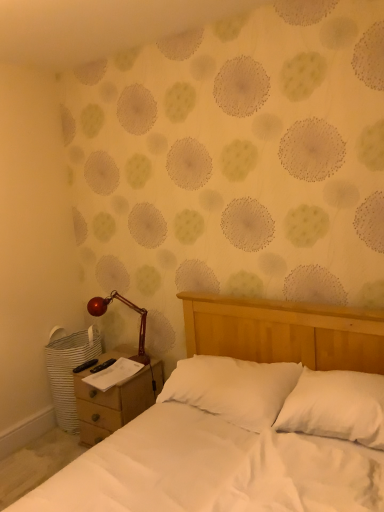
Question: Is white soft pillow at center, which appears as the 2th pillow when viewed from the left, bigger than shiny red metal lamp at left?

Choices:
 (A) yes
 (B) no

Answer: (A)

Question: Is white soft pillow at center, which appears as the 2th pillow when viewed from the left, smaller than shiny red metal lamp at left?

Choices:
 (A) yes
 (B) no

Answer: (B)

Question: Does white soft pillow at center, which appears as the 2th pillow when viewed from the left, appear on the left side of shiny red metal lamp at left?

Choices:
 (A) yes
 (B) no

Answer: (B)

Question: Does white soft pillow at center, which appears as the 2th pillow when viewed from the left, have a lesser width compared to shiny red metal lamp at left?

Choices:
 (A) no
 (B) yes

Answer: (A)

Question: From the image's perspective, would you say white soft pillow at center, which appears as the 2th pillow when viewed from the left, is shown under shiny red metal lamp at left?

Choices:
 (A) no
 (B) yes

Answer: (B)

Question: Based on their sizes in the image, would you say white soft pillow at center, which appears as the 2th pillow when viewed from the left, is bigger or smaller than white soft pillow at center, placed as the 1th pillow when sorted from left to right?

Choices:
 (A) small
 (B) big

Answer: (A)

Question: Relative to white soft pillow at center, the second pillow when ordered from right to left, is white soft pillow at center, the first pillow from the right, in front or behind?

Choices:
 (A) behind
 (B) front

Answer: (B)

Question: Considering the positions of white soft pillow at center, the first pillow from the right, and white soft pillow at center, the second pillow when ordered from right to left, in the image, is white soft pillow at center, the first pillow from the right, wider or thinner than white soft pillow at center, the second pillow when ordered from right to left,?

Choices:
 (A) thin
 (B) wide

Answer: (A)

Question: From the image's perspective, relative to white soft pillow at center, placed as the 1th pillow when sorted from left to right, is white soft pillow at center, which appears as the 2th pillow when viewed from the left, above or below?

Choices:
 (A) above
 (B) below

Answer: (A)

Question: Is white soft pillow at center, the first pillow from the right, bigger or smaller than shiny red metal lamp at left?

Choices:
 (A) big
 (B) small

Answer: (A)

Question: Is white soft pillow at center, which appears as the 2th pillow when viewed from the left, spatially inside shiny red metal lamp at left, or outside of it?

Choices:
 (A) outside
 (B) inside

Answer: (A)

Question: Based on their positions, is white soft pillow at center, which appears as the 2th pillow when viewed from the left, located to the left or right of shiny red metal lamp at left?

Choices:
 (A) left
 (B) right

Answer: (B)

Question: From a real-world perspective, relative to shiny red metal lamp at left, is white soft pillow at center, which appears as the 2th pillow when viewed from the left, vertically above or below?

Choices:
 (A) below
 (B) above

Answer: (A)

Question: Looking at their shapes, would you say white soft pillow at center, placed as the 1th pillow when sorted from left to right, is wider or thinner than white soft pillow at center, which appears as the 2th pillow when viewed from the left?

Choices:
 (A) thin
 (B) wide

Answer: (B)

Question: Based on their sizes in the image, would you say white soft pillow at center, the second pillow when ordered from right to left, is bigger or smaller than white soft pillow at center, which appears as the 2th pillow when viewed from the left?

Choices:
 (A) small
 (B) big

Answer: (B)